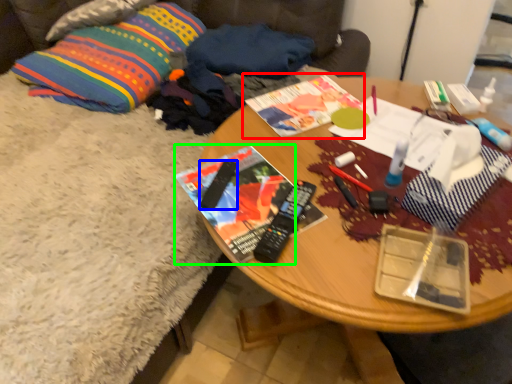
Question: Which object is the closest to the book (highlighted by a red box)? Choose among these: remote control (highlighted by a blue box) or magazine (highlighted by a green box).

Choices:
 (A) remote control
 (B) magazine

Answer: (B)